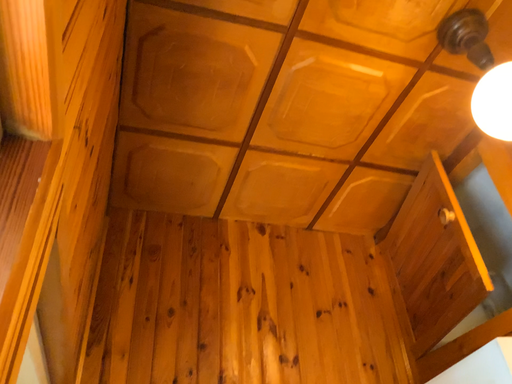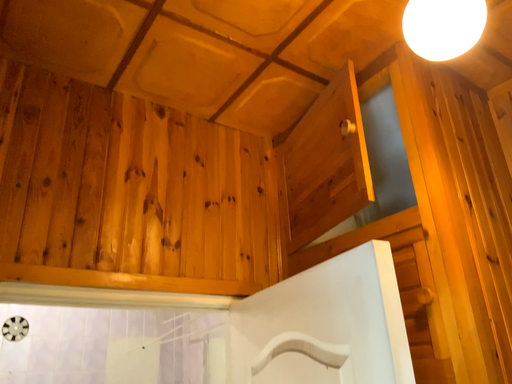
Question: Which way did the camera rotate in the video?

Choices:
 (A) rotated right
 (B) rotated left

Answer: (A)